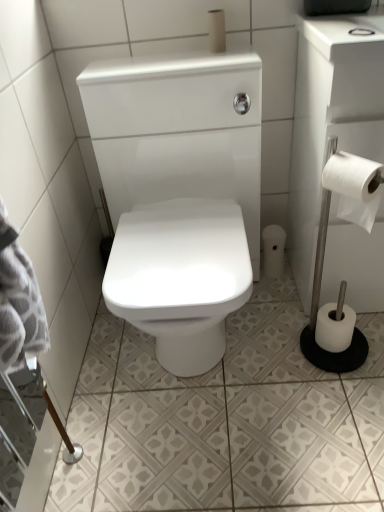
Locate an element on the screen. The height and width of the screenshot is (512, 384). free space to the left of white matte toilet paper at lower right, the 1th toilet paper in the bottom-to-top sequence is located at coordinates (278, 351).